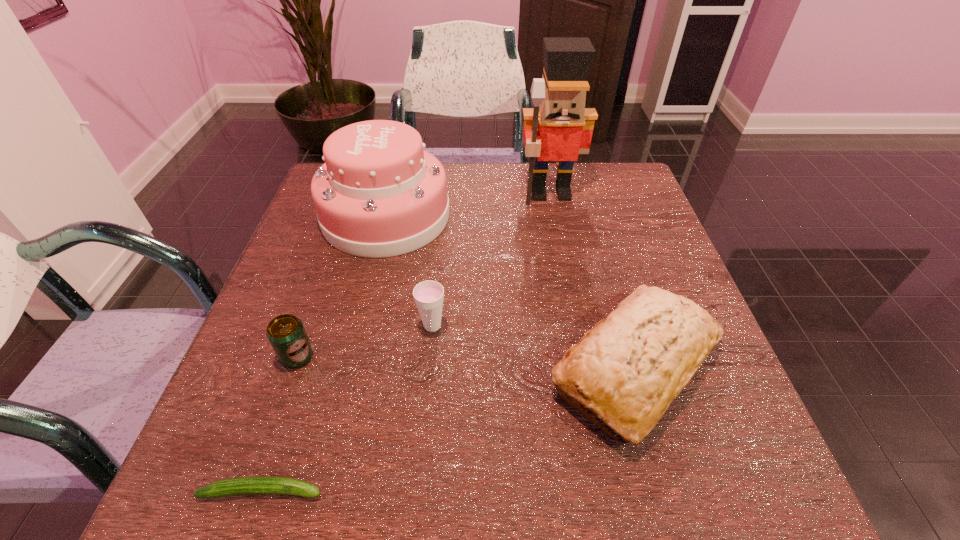
Identify the location of vacant space located 0.390m on the right of the cup. The width and height of the screenshot is (960, 540). (639, 326).

Image resolution: width=960 pixels, height=540 pixels. I want to click on vacant area located on the right of the beer can, so (518, 356).

The width and height of the screenshot is (960, 540). Find the location of `vacant space located on the front-facing side of the zucchini`. vacant space located on the front-facing side of the zucchini is located at coordinates (535, 491).

Image resolution: width=960 pixels, height=540 pixels. Find the location of `nutcracker positioned at the far edge`. nutcracker positioned at the far edge is located at coordinates (559, 127).

Identify the location of cake that is at the far edge. Image resolution: width=960 pixels, height=540 pixels. (379, 194).

The height and width of the screenshot is (540, 960). Find the location of `bread situated at the near edge`. bread situated at the near edge is located at coordinates (629, 368).

In order to click on zucchini that is at the near edge in this screenshot , I will do `click(242, 485)`.

Identify the location of cake situated at the left edge. The image size is (960, 540). (379, 194).

In order to click on beer can that is at the left edge in this screenshot , I will do `click(286, 333)`.

At what (x,y) coordinates should I click in order to perform the action: click on zucchini that is at the left edge. Please return your answer as a coordinate pair (x, y). The image size is (960, 540). Looking at the image, I should click on (242, 485).